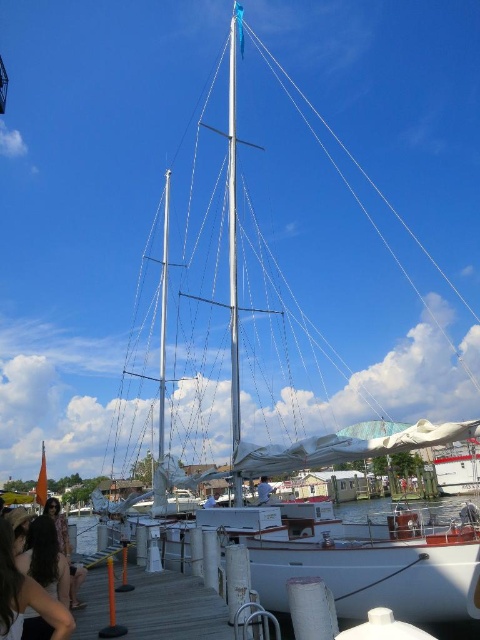
You are a dock worker who needs to ensure that the white matte sailboat at center can fit through a narrow channel between two piers. The channel is only as wide as the white fabric sail at center. Can the sailboat pass through the channel without any adjustments?

The white matte sailboat at center might be wider than white fabric sail at center, so there is a possibility that the sailboat cannot pass through the channel without adjustments.

You are a delivery drone carrying a package that requires a landing zone with at least 30 meters of clearance. You need to land between the silver metallic mast at center and the white matte sailboat at center. Is there enough space for you to land safely?

The silver metallic mast at center and the white matte sailboat at center are 25.97 meters apart from each other. Since the required clearance is 30 meters, the distance is insufficient. The drone cannot land safely between them.

You are standing at the edge of the wooden pier in the marina scene. You notice two points marked on the image, one at coordinates point (453,449) and another at point (264,499). Which point is closer to you as you face the scene?

Point (453,449) is closer to you because it is further to the viewer than point (264,499).